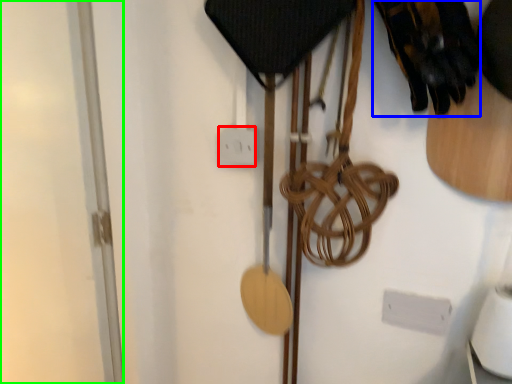
Question: Estimate the real-world distances between objects in this image. Which object is farther from electric outlet (highlighted by a red box), footwear (highlighted by a blue box) or glass door (highlighted by a green box)?

Choices:
 (A) footwear
 (B) glass door

Answer: (B)